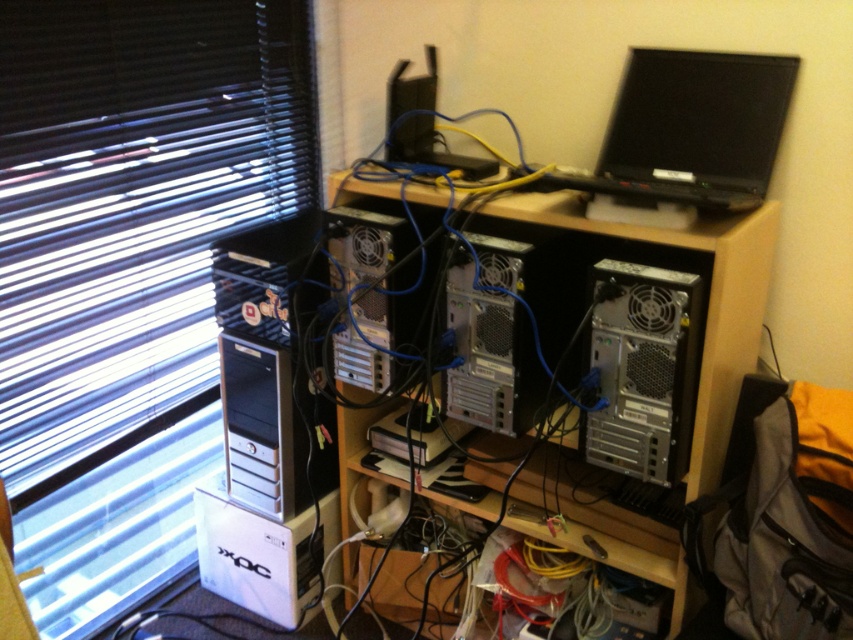
Is silver metallic computer desk at center shorter than black plastic speaker at center?

No.

Does silver metallic computer desk at center come in front of black plastic speaker at center?

Yes, silver metallic computer desk at center is in front of black plastic speaker at center.

Is point (605, 522) closer to camera compared to point (392, 145)?

Yes, point (605, 522) is closer to viewer.

Identify the location of silver metallic computer desk at center. This screenshot has width=853, height=640. (705, 300).

Does black glossy laptop at upper right have a smaller size compared to black plastic speaker at center?

Incorrect, black glossy laptop at upper right is not smaller in size than black plastic speaker at center.

The image size is (853, 640). What are the coordinates of `black glossy laptop at upper right` in the screenshot? It's located at (691, 129).

At what (x,y) coordinates should I click in order to perform the action: click on black glossy laptop at upper right. Please return your answer as a coordinate pair (x, y). Looking at the image, I should click on (691, 129).

Is silver metallic server at center-right shorter than silver metallic server at center?

Incorrect, silver metallic server at center-right's height does not fall short of silver metallic server at center's.

Measure the distance between silver metallic server at center-right and camera.

The distance of silver metallic server at center-right from camera is 1.22 meters.

You are a GUI agent. You are given a task and a screenshot of the screen. Output one action in this format:
    pyautogui.click(x=<x>, y=<y>)
    Task: Click on the silver metallic server at center-right
    The height and width of the screenshot is (640, 853).
    Given the screenshot: What is the action you would take?
    pyautogui.click(x=643, y=371)